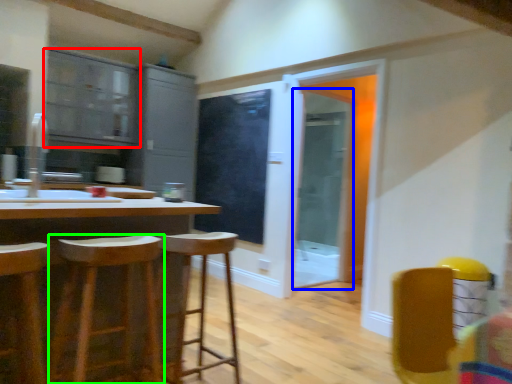
Question: Estimate the real-world distances between objects in this image. Which object is closer to cabinetry (highlighted by a red box), screen door (highlighted by a blue box) or stool (highlighted by a green box)?

Choices:
 (A) screen door
 (B) stool

Answer: (A)